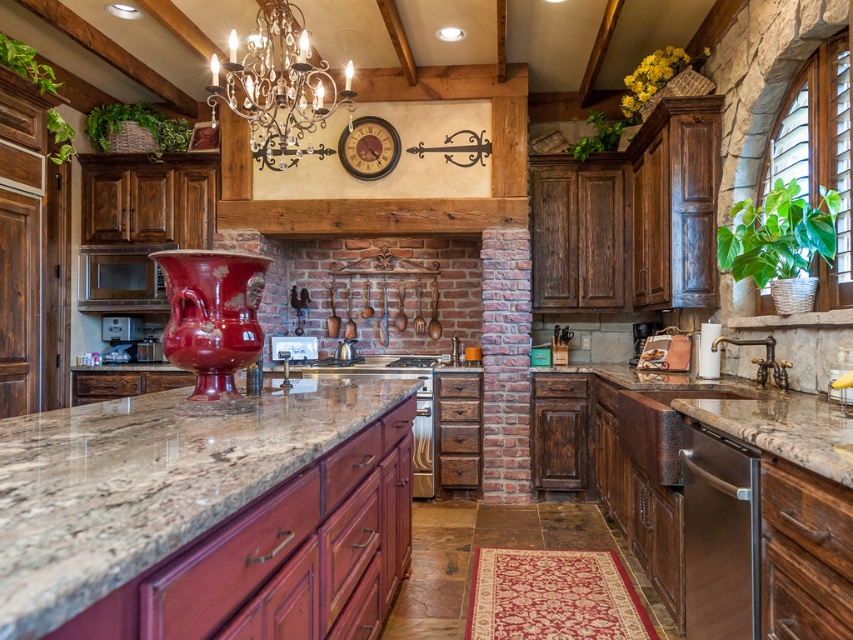
You are a kitchen designer planning to place a new appliance that requires a surface area of 2 square meters. You have the brown granite countertop at center and the satin stainless steel dishwasher at lower right available. Which surface can accommodate the appliance?

The brown granite countertop at center is larger in size than the satin stainless steel dishwasher at lower right, so the brown granite countertop at center can accommodate the appliance.

You are a kitchen designer planning to install a new appliance. You see the satin stainless steel dishwasher at lower right and the silver metallic chandelier at upper center. Which object is located to the right of the other?

The satin stainless steel dishwasher at lower right is positioned on the right side of silver metallic chandelier at upper center.

You are a chef preparing to place a large cutting board on the counter. The board is too heavy to lift, so you need to slide it from the brown granite countertop at center to the satin stainless steel dishwasher at lower right. In which direction should you push the board to move it towards the dishwasher?

The brown granite countertop at center is to the left of the satin stainless steel dishwasher at lower right, so you should push the board to the right to move it towards the dishwasher.